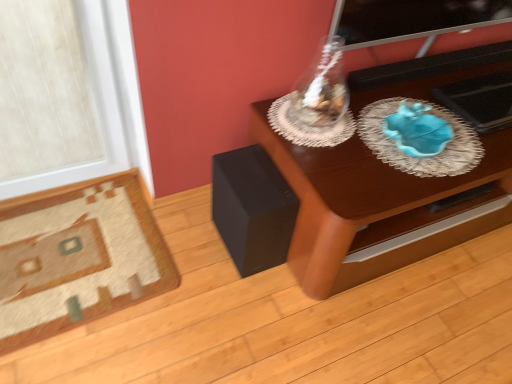
This screenshot has width=512, height=384. Find the location of `empty space that is to the right of carpeted rug at lower left`. empty space that is to the right of carpeted rug at lower left is located at coordinates (206, 295).